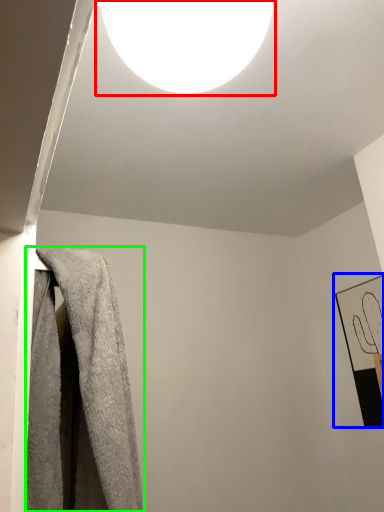
Question: Which object is positioned farthest from lamp (highlighted by a red box)? Select from picture frame (highlighted by a blue box) and towel (highlighted by a green box).

Choices:
 (A) picture frame
 (B) towel

Answer: (A)